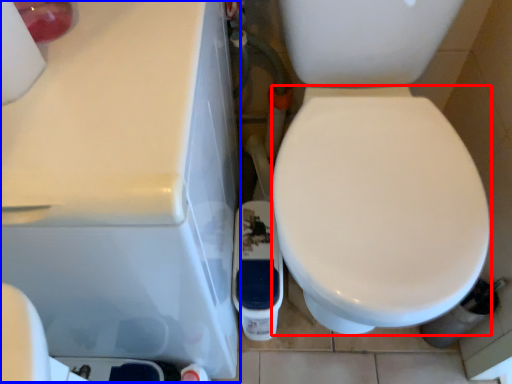
Question: Which of the following is the farthest to the observer, bidet (highlighted by a red box) or porcelain (highlighted by a blue box)?

Choices:
 (A) bidet
 (B) porcelain

Answer: (B)